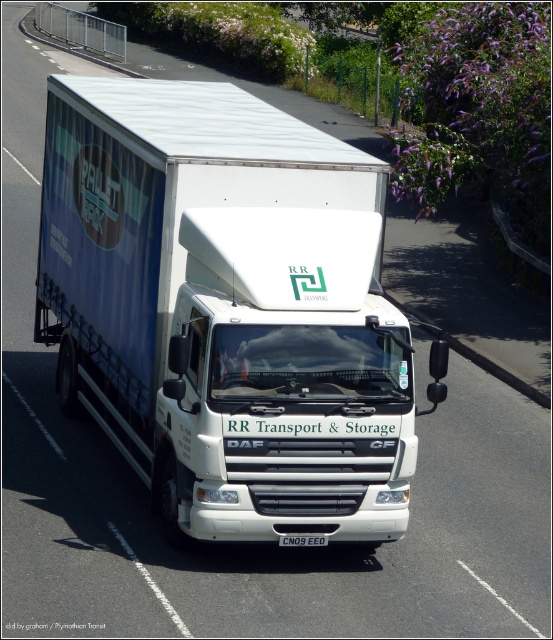
Who is positioned more to the right, white matte truck at center or black plastic license plate at center?

From the viewer's perspective, white matte truck at center appears more on the right side.

Who is more forward, (280, 477) or (324, 545)?

Positioned in front is point (280, 477).

In order to click on white matte truck at center in this screenshot , I will do `click(227, 308)`.